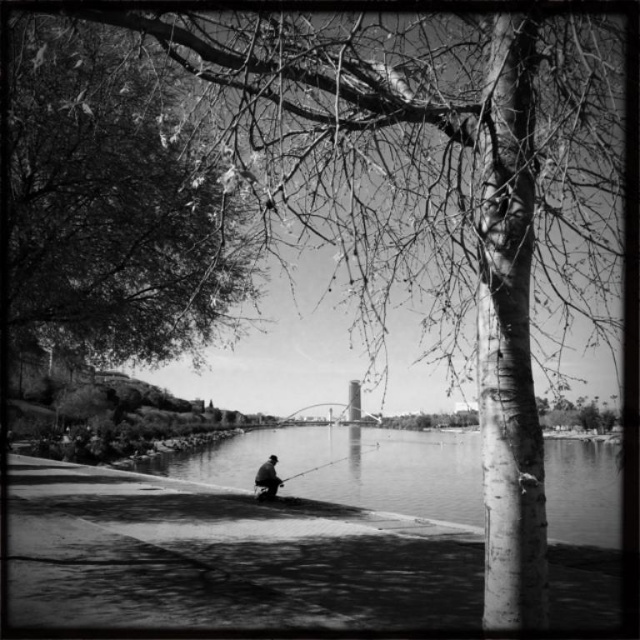
You are an artist planning to paint this riverside scene. You want to ensure the smooth bark tree at upper left and the smooth water at lower center are proportionally accurate. Which object should you make narrower in your painting?

The smooth bark tree at upper left should be made narrower in the painting because its width is less than the smooth water at lower center according to the description.

You are an observer standing on the riverside. You see the smooth water at lower center and the smooth metallic fishing pole at center. Which object is closer to the right side of the image?

The smooth water at lower center is closer to the right side of the image because it is positioned to the right of the smooth metallic fishing pole at center.

You are standing at the riverside and want to determine which of the two points, point (268, 477) or point (369, 444), is closer to you. Based on the scene description, can you identify which point is nearer?

Point (268, 477) is closer to the camera than point (369, 444), so it is the nearer one.